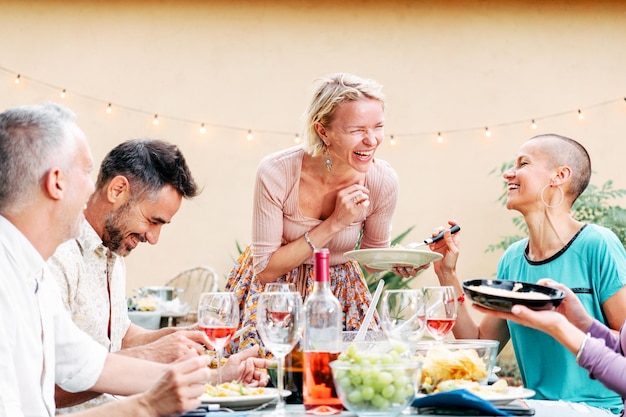
Locate an element on the screen. plate is located at coordinates (245, 402), (398, 262), (505, 298), (510, 396).